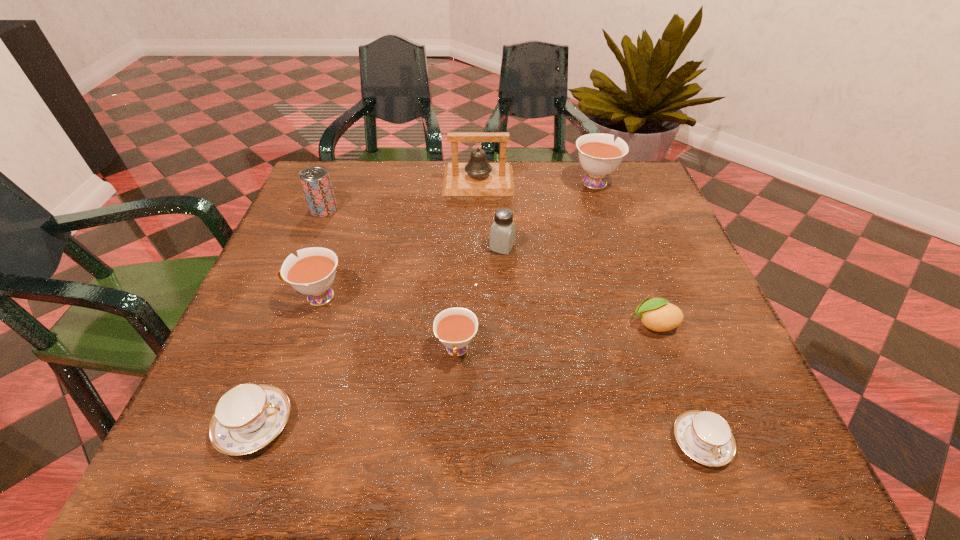
What are the coordinates of `free point between the rightmost white teacup and the second farthest white teacup` in the screenshot? It's located at (455, 239).

Identify the location of vacant area between the third teacup from left to right and the fourth farthest object. The image size is (960, 540). (480, 299).

Where is `unoccupied position between the left blue teacup and the tallest object`? The image size is (960, 540). unoccupied position between the left blue teacup and the tallest object is located at coordinates (367, 302).

Locate an element on the screen. This screenshot has width=960, height=540. free space between the beer can and the bigger blue teacup is located at coordinates pyautogui.click(x=290, y=317).

Locate an element on the screen. vacant space that's between the bell and the bigger blue teacup is located at coordinates (x=367, y=302).

Identify the location of the fourth closest object to the saltshaker. (657, 314).

Identify which object is the second closest to the smallest white teacup. Please provide its 2D coordinates. Your answer should be formatted as a tuple, i.e. [(x, y)], where the tuple contains the x and y coordinates of a point satisfying the conditions above.

[(503, 230)]

Identify which teacup is located as the nearest to the second white teacup from left to right. Please provide its 2D coordinates. Your answer should be formatted as a tuple, i.e. [(x, y)], where the tuple contains the x and y coordinates of a point satisfying the conditions above.

[(312, 273)]

Image resolution: width=960 pixels, height=540 pixels. Find the location of `the fifth closest teacup relative to the saltshaker`. the fifth closest teacup relative to the saltshaker is located at coordinates (247, 417).

Point out which white teacup is positioned as the second nearest to the shortest object. Please provide its 2D coordinates. Your answer should be formatted as a tuple, i.e. [(x, y)], where the tuple contains the x and y coordinates of a point satisfying the conditions above.

[(312, 273)]